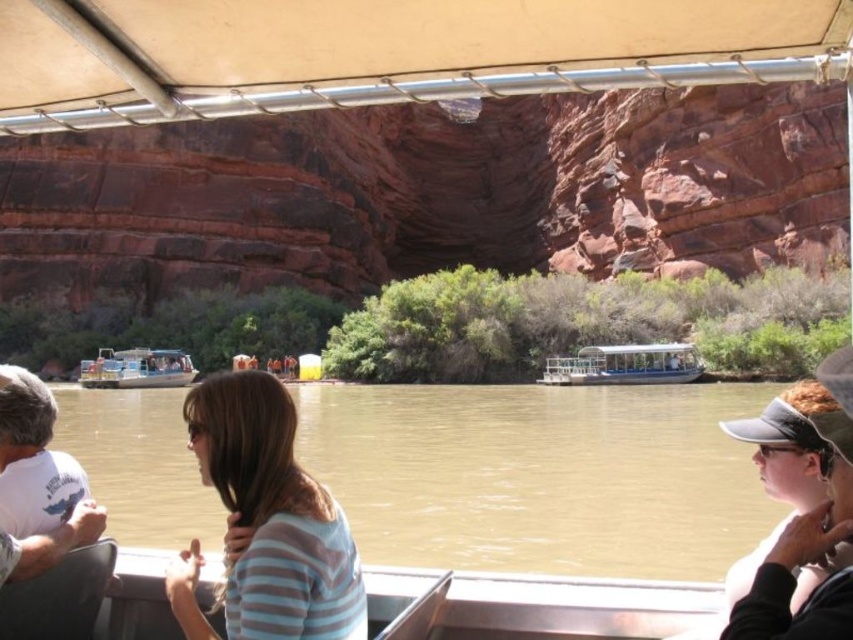
Between matte black visor at lower right and white plastic boat at center, which one has less height?

Standing shorter between the two is white plastic boat at center.

Between matte black visor at lower right and white plastic boat at center, which one is positioned lower?

matte black visor at lower right

Which is behind, point (741, 595) or point (581, 385)?

Point (581, 385)

Where is `matte black visor at lower right`? This screenshot has width=853, height=640. matte black visor at lower right is located at coordinates (807, 545).

Between brown matte water at center and white plastic boat at left, which one is positioned lower?

brown matte water at center is below.

Who is more distant from viewer, (518,515) or (122,387)?

The point (122,387) is behind.

The image size is (853, 640). I want to click on brown matte water at center, so click(x=541, y=476).

Does brown matte water at center appear on the left side of white plastic boat at center?

Correct, you'll find brown matte water at center to the left of white plastic boat at center.

I want to click on brown matte water at center, so click(x=541, y=476).

Is point (474, 566) less distant than point (680, 371)?

Yes, point (474, 566) is in front of point (680, 371).

Where is `brown matte water at center`? This screenshot has width=853, height=640. brown matte water at center is located at coordinates (541, 476).